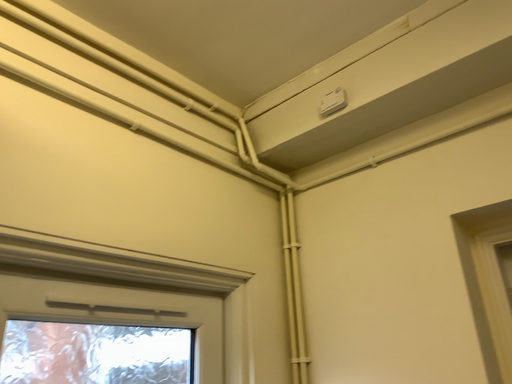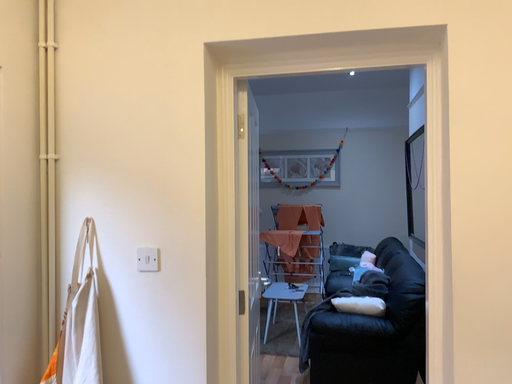
Question: Which way did the camera rotate in the video?

Choices:
 (A) rotated left
 (B) rotated right

Answer: (B)